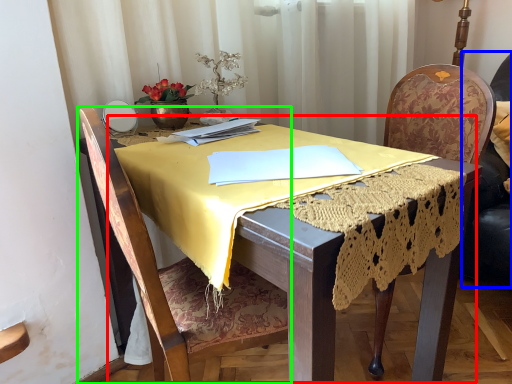
Question: Estimate the real-world distances between objects in this image. Which object is farther from round table (highlighted by a red box), swivel chair (highlighted by a blue box) or chair (highlighted by a green box)?

Choices:
 (A) swivel chair
 (B) chair

Answer: (A)